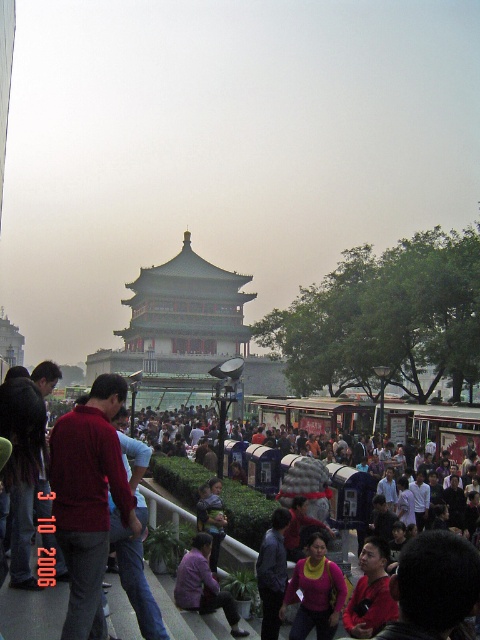
Does purple fabric shirt at lower center appear on the right side of dark blue jacket at center?

In fact, purple fabric shirt at lower center is to the left of dark blue jacket at center.

What do you see at coordinates (204, 586) in the screenshot?
I see `purple fabric shirt at lower center` at bounding box center [204, 586].

Identify the location of purple fabric shirt at lower center. This screenshot has width=480, height=640. (204, 586).

Which of these two, matte pink sweater at center or purple fabric shirt at lower center, stands taller?

matte pink sweater at center is taller.

Who is lower down, matte pink sweater at center or purple fabric shirt at lower center?

purple fabric shirt at lower center is below.

Which is behind, point (314, 621) or point (189, 576)?

Positioned behind is point (189, 576).

Where is `matte pink sweater at center`? Image resolution: width=480 pixels, height=640 pixels. matte pink sweater at center is located at coordinates (315, 593).

Is red matte shirt at lower right thinner than dark blue jacket at center?

No.

Which is more to the right, red matte shirt at lower right or dark blue jacket at center?

red matte shirt at lower right is more to the right.

The height and width of the screenshot is (640, 480). What are the coordinates of `red matte shirt at lower right` in the screenshot? It's located at (371, 593).